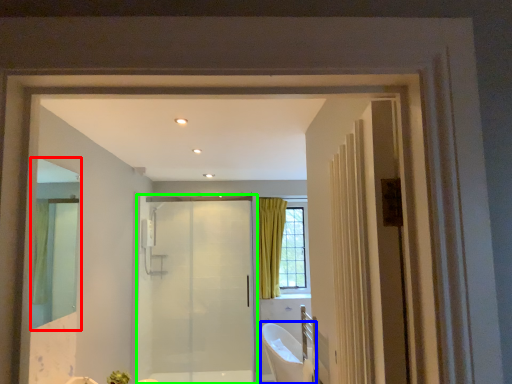
Question: Which object is the farthest from mirror (highlighted by a red box)? Choose among these: bath (highlighted by a blue box) or door (highlighted by a green box).

Choices:
 (A) bath
 (B) door

Answer: (A)